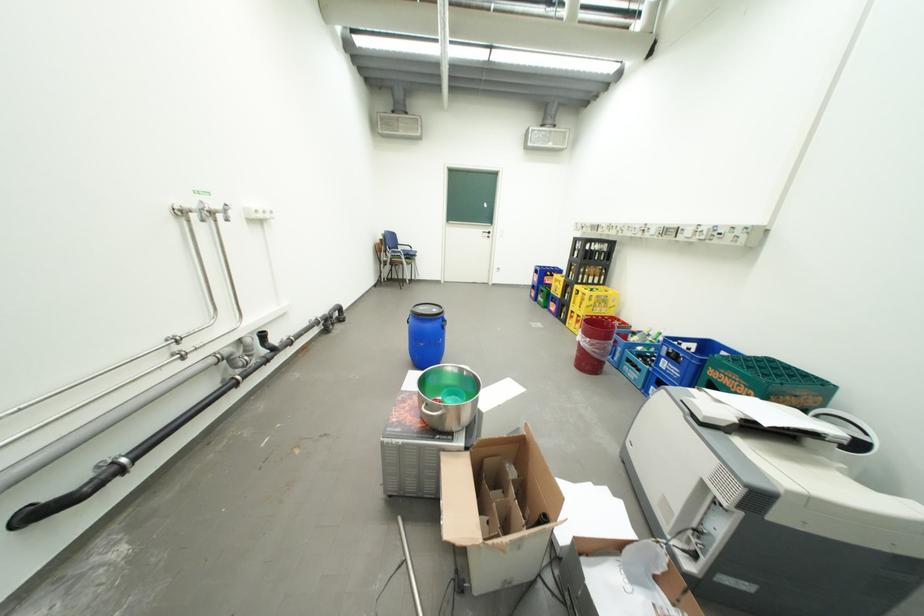
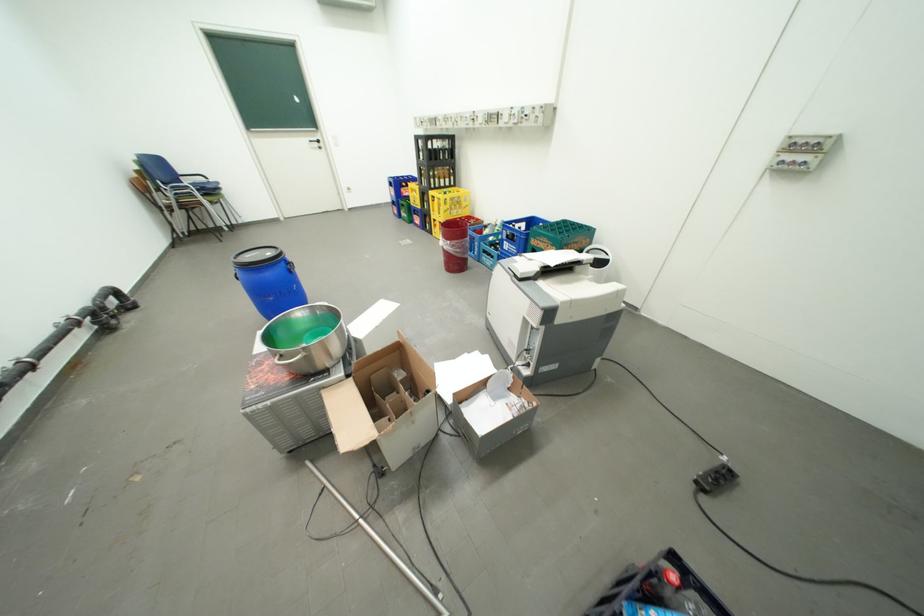
The point at (x=450, y=320) is marked in the first image. Where is the corresponding point in the second image?

(290, 262)